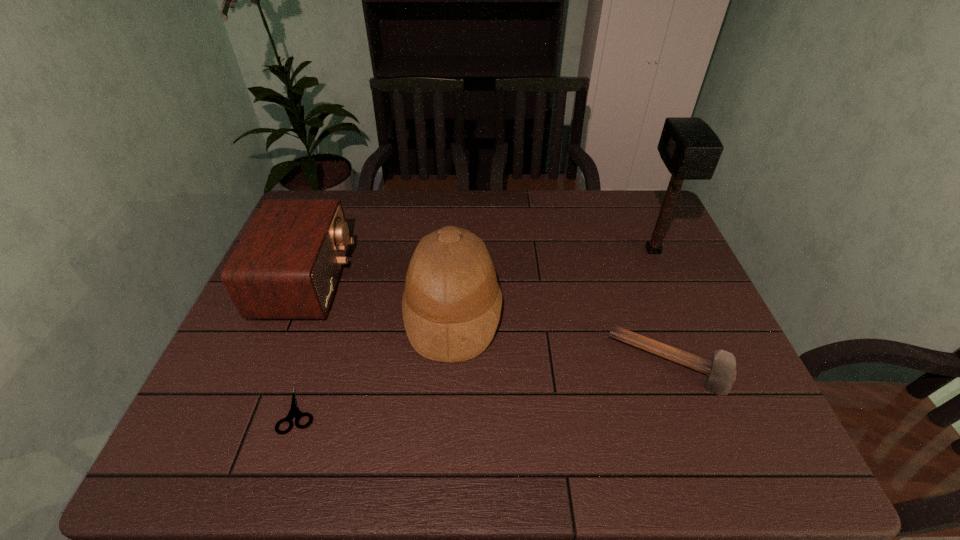
Locate an element on the screen. This screenshot has height=540, width=960. vacant area situated 0.310m on the front panel of the radio receiver is located at coordinates (456, 281).

You are a GUI agent. You are given a task and a screenshot of the screen. Output one action in this format:
    pyautogui.click(x=<x>, y=<y>)
    Task: Click on the vacant space located 0.140m on the back of the second shortest object
    The width and height of the screenshot is (960, 540).
    Given the screenshot: What is the action you would take?
    pyautogui.click(x=644, y=292)

Where is `free location located 0.290m on the back of the shortest object`? free location located 0.290m on the back of the shortest object is located at coordinates (336, 295).

Find the location of a particular element. The image size is (960, 540). object present at the near edge is located at coordinates (294, 412).

Locate an element on the screen. object located in the left edge section of the desktop is located at coordinates click(287, 265).

You are a GUI agent. You are given a task and a screenshot of the screen. Output one action in this format:
    pyautogui.click(x=<x>, y=<y>)
    Task: Click on the blank space at the far edge of the desktop
    
    Given the screenshot: What is the action you would take?
    pyautogui.click(x=420, y=207)

In the image, there is a desktop. Identify the location of vacant space at the near edge. This screenshot has height=540, width=960. (291, 449).

In order to click on free space at the right edge in this screenshot , I will do `click(661, 332)`.

I want to click on free space at the near left corner, so click(x=211, y=451).

Identify the location of vacant space at the far right corner of the desktop. This screenshot has height=540, width=960. (658, 199).